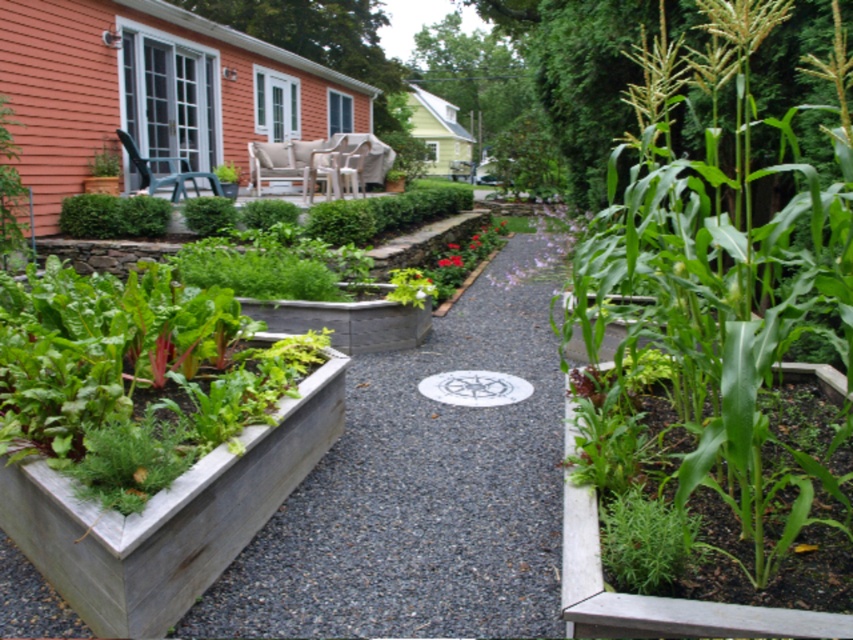
Is smooth gray planter at lower left thinner than green leafy plant at center?

In fact, smooth gray planter at lower left might be wider than green leafy plant at center.

Can you confirm if smooth gray planter at lower left is positioned below green leafy plant at center?

Incorrect, smooth gray planter at lower left is not positioned below green leafy plant at center.

Image resolution: width=853 pixels, height=640 pixels. Find the location of `smooth gray planter at lower left`. smooth gray planter at lower left is located at coordinates (167, 516).

This screenshot has width=853, height=640. I want to click on smooth gray planter at lower left, so click(167, 516).